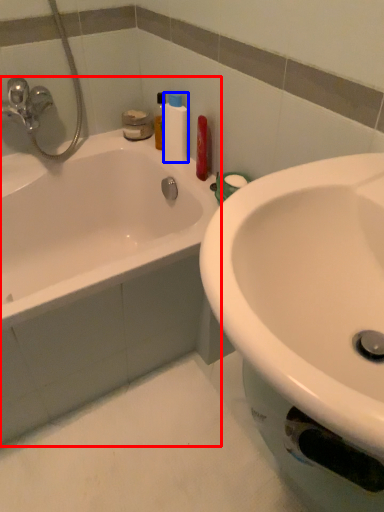
Question: Among these objects, which one is farthest to the camera, bathtub (highlighted by a red box) or cleaning product (highlighted by a blue box)?

Choices:
 (A) bathtub
 (B) cleaning product

Answer: (B)